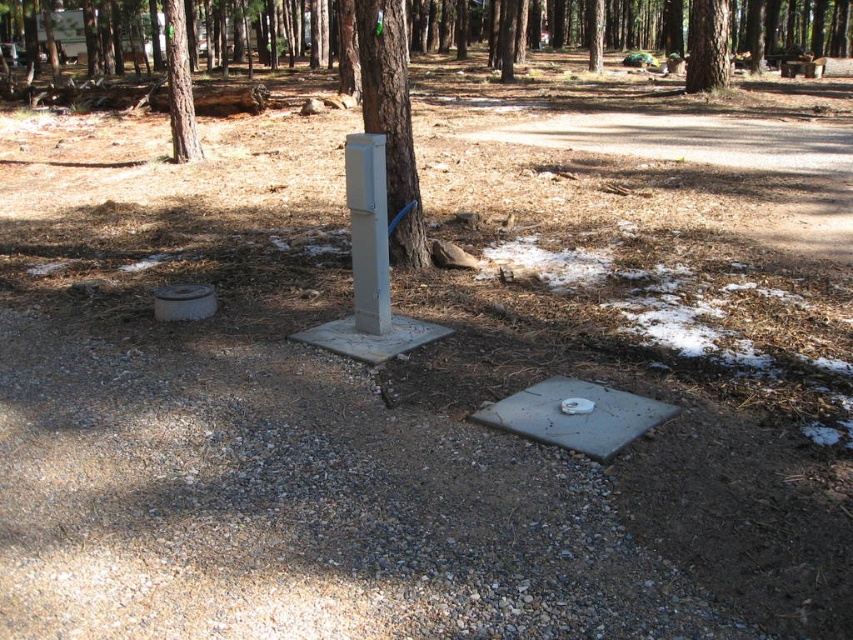
Who is lower down, brown rough tree at upper left or brown textured tree at upper center?

Positioned lower is brown rough tree at upper left.

Who is more forward, (170, 45) or (695, 26)?

Positioned in front is point (170, 45).

Measure the distance between brown rough tree at upper left and camera.

brown rough tree at upper left and camera are 32.92 feet apart.

Locate an element on the screen. The width and height of the screenshot is (853, 640). brown rough tree at upper left is located at coordinates (180, 86).

Can you confirm if gray metallic utility box at center is positioned above gray matte utility box at center?

Indeed, gray metallic utility box at center is positioned over gray matte utility box at center.

Is gray metallic utility box at center to the right of gray matte utility box at center from the viewer's perspective?

Indeed, gray metallic utility box at center is positioned on the right side of gray matte utility box at center.

Between point (369, 33) and point (364, 273), which one is positioned in front?

Point (364, 273)

Identify the location of gray metallic utility box at center. (392, 124).

Which is more to the left, gray metallic utility box at center or brown textured tree at upper center?

gray metallic utility box at center

Does gray metallic utility box at center appear over brown textured tree at upper center?

Incorrect, gray metallic utility box at center is not positioned above brown textured tree at upper center.

Where is `gray metallic utility box at center`? The image size is (853, 640). gray metallic utility box at center is located at coordinates (392, 124).